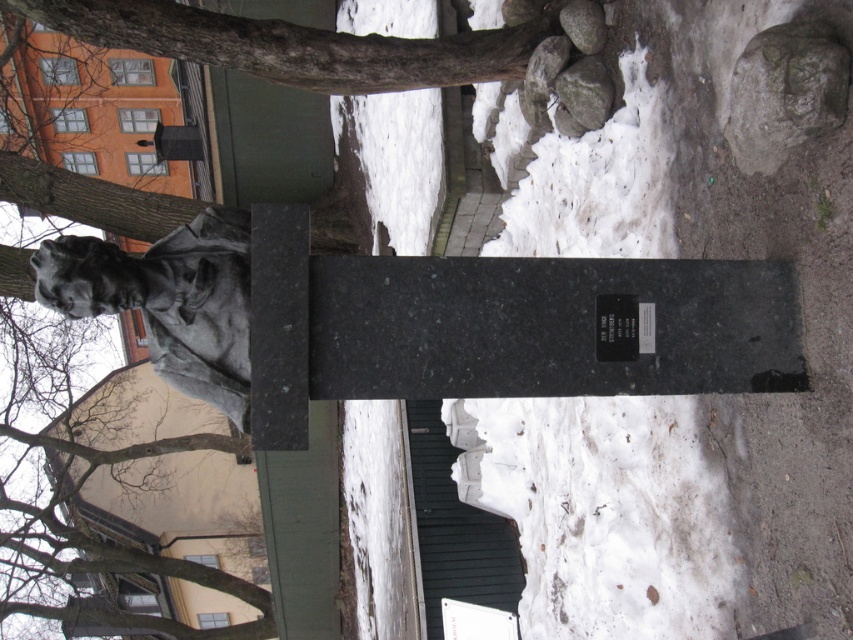
Does brown rough bark at upper center come in front of gray rough stone at upper center?

Yes, brown rough bark at upper center is in front of gray rough stone at upper center.

Who is more forward, (479,65) or (598,112)?

Point (598,112) is more forward.

At what (x,y) coordinates should I click in order to perform the action: click on brown rough bark at upper center. Please return your answer as a coordinate pair (x, y). The height and width of the screenshot is (640, 853). Looking at the image, I should click on (296, 49).

Image resolution: width=853 pixels, height=640 pixels. I want to click on brown rough bark at upper center, so click(x=296, y=49).

Which of these two, brown rough bark at upper center or gray rough stone at upper right, stands taller?

brown rough bark at upper center is taller.

Between brown rough bark at upper center and gray rough stone at upper right, which one appears on the left side from the viewer's perspective?

brown rough bark at upper center

You are a GUI agent. You are given a task and a screenshot of the screen. Output one action in this format:
    pyautogui.click(x=<x>, y=<y>)
    Task: Click on the brown rough bark at upper center
    
    Given the screenshot: What is the action you would take?
    pyautogui.click(x=296, y=49)

Locate an element on the screen. This screenshot has height=640, width=853. brown rough bark at upper center is located at coordinates (296, 49).

Can you confirm if brown rough bark at upper center is positioned to the right of smooth gray rock at upper right?

Incorrect, brown rough bark at upper center is not on the right side of smooth gray rock at upper right.

Can you confirm if brown rough bark at upper center is positioned above smooth gray rock at upper right?

No, brown rough bark at upper center is not above smooth gray rock at upper right.

The height and width of the screenshot is (640, 853). Find the location of `brown rough bark at upper center`. brown rough bark at upper center is located at coordinates (296, 49).